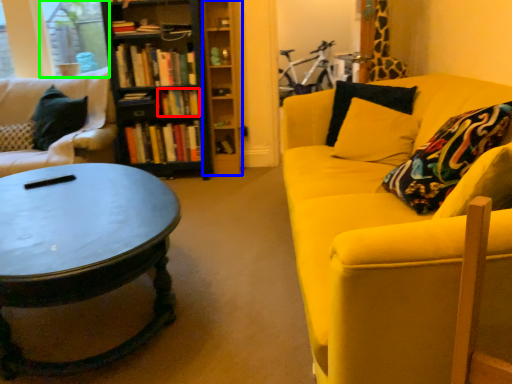
Question: Based on their relative distances, which object is farther from book (highlighted by a red box)? Choose from shelf (highlighted by a blue box) and window screen (highlighted by a green box).

Choices:
 (A) shelf
 (B) window screen

Answer: (B)